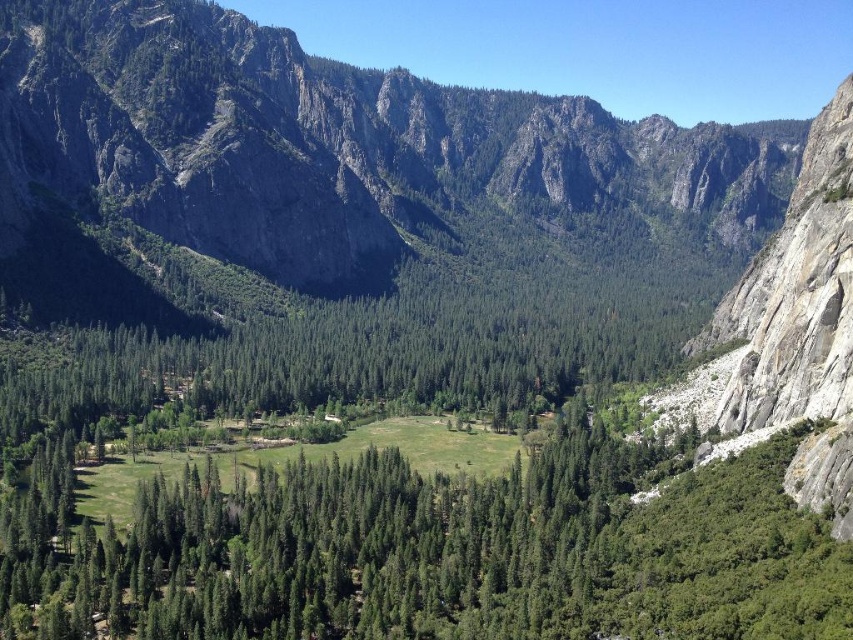
Is dark gray rocky mountain at center behind green leafy trees at center?

Yes.

Does point (198, 112) lie behind point (241, 496)?

Yes, point (198, 112) is farther from viewer.

Where is `dark gray rocky mountain at center`? dark gray rocky mountain at center is located at coordinates (358, 150).